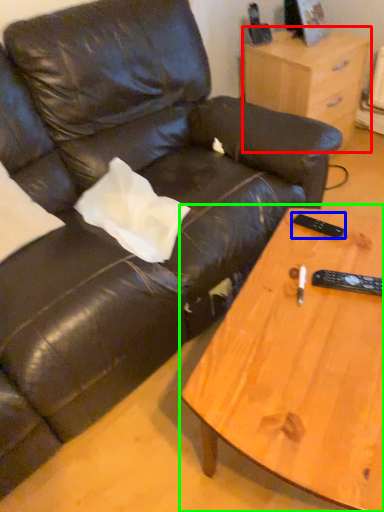
Question: Estimate the real-world distances between objects in this image. Which object is closer to nightstand (highlighted by a red box), remote (highlighted by a blue box) or coffee table (highlighted by a green box)?

Choices:
 (A) remote
 (B) coffee table

Answer: (A)